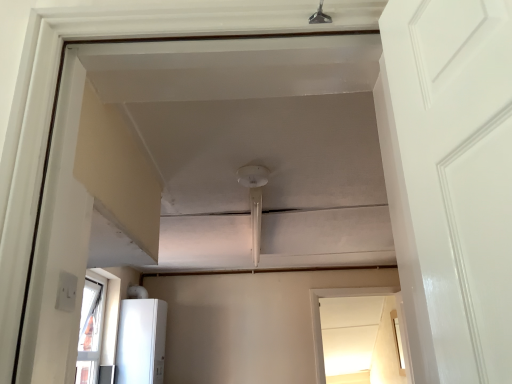
The height and width of the screenshot is (384, 512). What are the coordinates of `white glossy refrigerator at lower left` in the screenshot? It's located at (141, 341).

Describe the element at coordinates (141, 341) in the screenshot. I see `white glossy refrigerator at lower left` at that location.

Describe the element at coordinates (319, 316) in the screenshot. I see `transparent glass window at center` at that location.

Where is `transparent glass window at center`? transparent glass window at center is located at coordinates (319, 316).

Image resolution: width=512 pixels, height=384 pixels. Find the location of `white glossy refrigerator at lower left`. white glossy refrigerator at lower left is located at coordinates (141, 341).

Between white glossy refrigerator at lower left and transparent glass window at center, which one appears on the right side from the viewer's perspective?

From the viewer's perspective, transparent glass window at center appears more on the right side.

Considering the positions of objects white glossy refrigerator at lower left and transparent glass window at center in the image provided, who is behind, white glossy refrigerator at lower left or transparent glass window at center?

Positioned behind is transparent glass window at center.

Is point (150, 378) closer to viewer compared to point (322, 289)?

Yes, it is in front of point (322, 289).

From the image's perspective, is white glossy refrigerator at lower left above or below transparent glass window at center?

From the image's perspective, white glossy refrigerator at lower left appears above transparent glass window at center.

From a real-world perspective, is white glossy refrigerator at lower left above or below transparent glass window at center?

white glossy refrigerator at lower left is above transparent glass window at center.

Which object is thinner, white glossy refrigerator at lower left or transparent glass window at center?

transparent glass window at center.

Considering the sizes of objects white glossy refrigerator at lower left and transparent glass window at center in the image provided, who is taller, white glossy refrigerator at lower left or transparent glass window at center?

transparent glass window at center is taller.

Considering the sizes of objects white glossy refrigerator at lower left and transparent glass window at center in the image provided, who is bigger, white glossy refrigerator at lower left or transparent glass window at center?

With larger size is white glossy refrigerator at lower left.

Looking at this image, is white glossy refrigerator at lower left inside or outside of transparent glass window at center?

white glossy refrigerator at lower left is not enclosed by transparent glass window at center.

Are white glossy refrigerator at lower left and transparent glass window at center making contact?

white glossy refrigerator at lower left and transparent glass window at center are not in contact.

Is white glossy refrigerator at lower left turned away from transparent glass window at center?

No, white glossy refrigerator at lower left's orientation is not away from transparent glass window at center.

How different are the orientations of white glossy refrigerator at lower left and transparent glass window at center in degrees?

90 degrees separate the facing orientations of white glossy refrigerator at lower left and transparent glass window at center.

How far apart are white glossy refrigerator at lower left and transparent glass window at center?

They are 5.20 feet apart.

In the image, there is a white glossy refrigerator at lower left. At what (x,y) coordinates should I click in order to perform the action: click on window below it (from the image's perspective). Please return your answer as a coordinate pair (x, y). Image resolution: width=512 pixels, height=384 pixels. Looking at the image, I should click on (319, 316).

Is transparent glass window at center at the left side of white glossy refrigerator at lower left?

No, transparent glass window at center is not to the left of white glossy refrigerator at lower left.

Considering the relative positions of transparent glass window at center and white glossy refrigerator at lower left in the image provided, is transparent glass window at center in front of white glossy refrigerator at lower left?

That is False.

Is point (318, 348) farther from camera compared to point (120, 383)?

Yes, point (318, 348) is farther from viewer.

From the image's perspective, which object appears higher, transparent glass window at center or white glossy refrigerator at lower left?

white glossy refrigerator at lower left.

From a real-world perspective, who is located higher, transparent glass window at center or white glossy refrigerator at lower left?

From a 3D spatial view, white glossy refrigerator at lower left is above.

Looking at their sizes, would you say transparent glass window at center is wider or thinner than white glossy refrigerator at lower left?

transparent glass window at center is thinner than white glossy refrigerator at lower left.

Does transparent glass window at center have a greater height compared to white glossy refrigerator at lower left?

Yes.

Is transparent glass window at center bigger than white glossy refrigerator at lower left?

Actually, transparent glass window at center might be smaller than white glossy refrigerator at lower left.

Is white glossy refrigerator at lower left located within transparent glass window at center?

That's incorrect, white glossy refrigerator at lower left is not inside transparent glass window at center.

Are transparent glass window at center and white glossy refrigerator at lower left beside each other?

No, transparent glass window at center is not with white glossy refrigerator at lower left.

Is transparent glass window at center oriented away from white glossy refrigerator at lower left?

No, transparent glass window at center is not facing away from white glossy refrigerator at lower left.

How many degrees apart are the facing directions of transparent glass window at center and white glossy refrigerator at lower left?

90 degrees separate the facing orientations of transparent glass window at center and white glossy refrigerator at lower left.

This screenshot has width=512, height=384. Identify the location of appliance that is in front of the transparent glass window at center. (141, 341).

You are a GUI agent. You are given a task and a screenshot of the screen. Output one action in this format:
    pyautogui.click(x=<x>, y=<y>)
    Task: Click on the appliance located above the transparent glass window at center (from the image's perspective)
    The image size is (512, 384).
    Given the screenshot: What is the action you would take?
    pyautogui.click(x=141, y=341)

Identify the location of window below the white glossy refrigerator at lower left (from the image's perspective). pos(319,316).